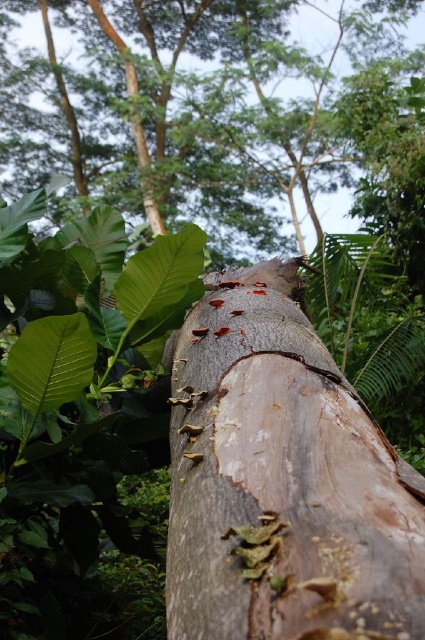
From the picture: You are an environmental scientist studying the tree trunk in the forest. You observe the smooth brown bark at center and the rusty wood tree trunk at center. Which part of the tree trunk is taller?

The smooth brown bark at center is much taller than the rusty wood tree trunk at center.

You are a hiker navigating through the forest and want to place a marker at the point that is closer to you. Which point should you choose between point (404, 58) and point (365, 570)?

Point (365, 570) is closer to you, so you should place the marker there.